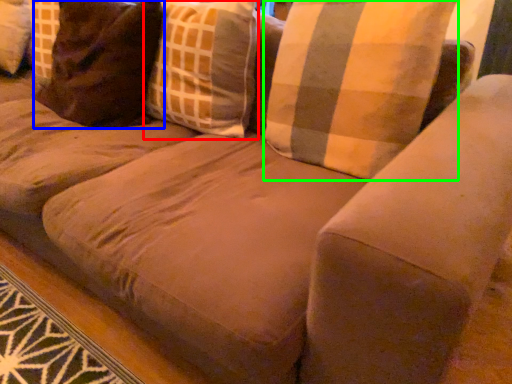
Question: Considering the real-world distances, which object is farthest from throw pillow (highlighted by a red box)? pillow (highlighted by a blue box) or pillow (highlighted by a green box)?

Choices:
 (A) pillow
 (B) pillow

Answer: (B)